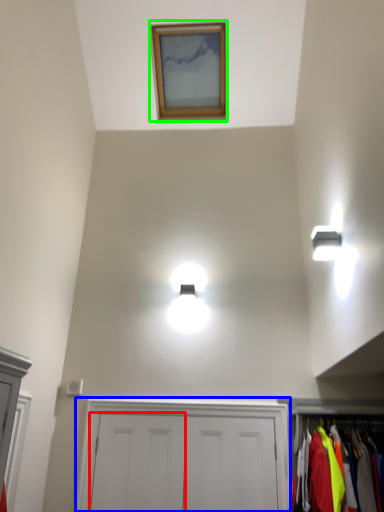
Question: Which object is the closest to the door (highlighted by a red box)? Choose among these: dresser (highlighted by a blue box) or picture frame (highlighted by a green box).

Choices:
 (A) dresser
 (B) picture frame

Answer: (A)